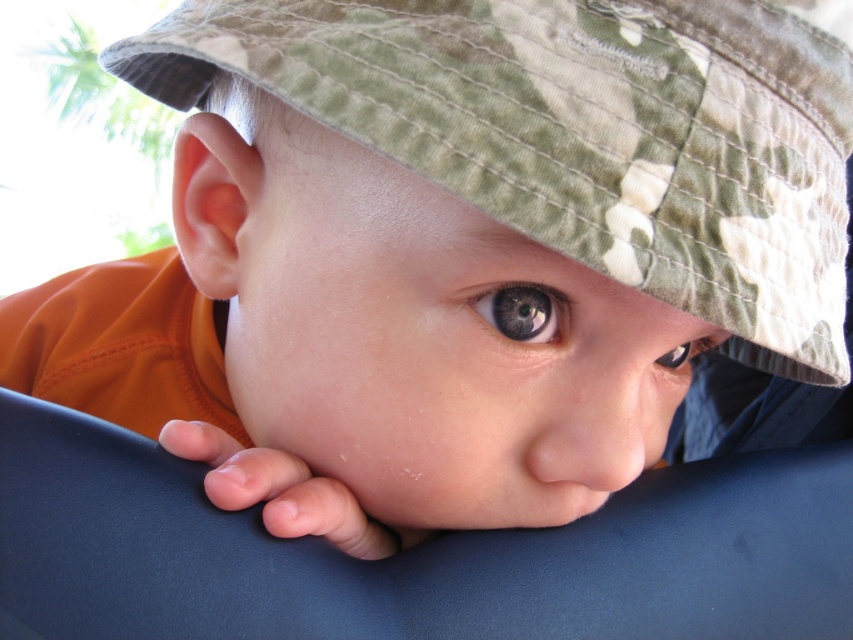
Question: Observing the image, what is the correct spatial positioning of green matte eye at center in reference to brown matte eye at center?

Choices:
 (A) above
 (B) below

Answer: (A)

Question: Does green matte eye at center come behind brown matte eye at center?

Choices:
 (A) yes
 (B) no

Answer: (B)

Question: Among these objects, which one is farthest from the camera?

Choices:
 (A) green matte eye at center
 (B) brown matte eye at center

Answer: (B)

Question: Which point is closer to the camera?

Choices:
 (A) green matte eye at center
 (B) brown matte eye at center

Answer: (A)

Question: Which point is closer to the camera?

Choices:
 (A) brown matte eye at center
 (B) green matte eye at center

Answer: (B)

Question: Observing the image, what is the correct spatial positioning of green matte eye at center in reference to brown matte eye at center?

Choices:
 (A) above
 (B) below

Answer: (A)